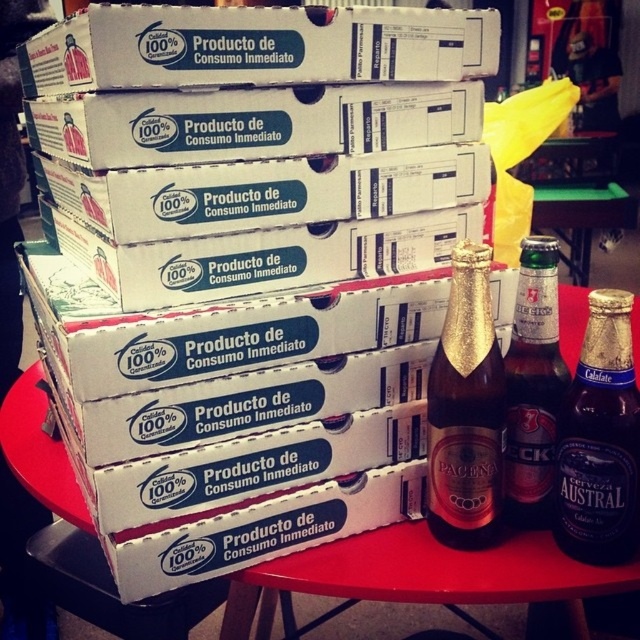
You are a delivery person who needs to place a 10 cm wide package between the gold foil beer bottle at center and the dark glass bottle at center right. Can you fit it there?

The distance between the gold foil beer bottle at center and the dark glass bottle at center right is 8.55 centimeters, so the 10 cm wide package cannot fit in that space.

You are standing in front of the stack of boxes and want to reach two points marked on the image. Which point, point 1 at coordinates (564, 518) or point 2 at coordinates (536, 422), is closer to you?

Point 1 at coordinates (564, 518) is closer to you than point 2 at coordinates (536, 422).

You are at a party and want to grab a drink. You see a gold foil beer bottle at center and a green glass bottle at center right. Which one can you reach first without moving your position?

The gold foil beer bottle at center is closer to the viewer than the green glass bottle at center right, so you can reach it first without moving.